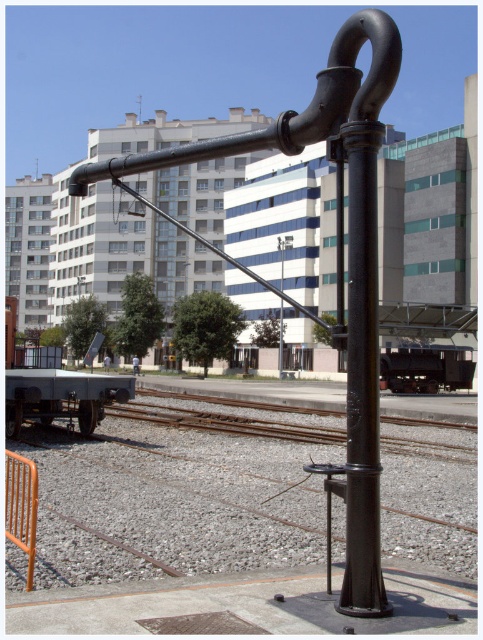
Is black matte pipe at center bigger than orange metallic rail at lower left?

Correct, black matte pipe at center is larger in size than orange metallic rail at lower left.

Does point (228, 150) come in front of point (32, 524)?

Yes.

At what (x,y) coordinates should I click in order to perform the action: click on black matte pipe at center. Please return your answer as a coordinate pair (x, y). This screenshot has height=640, width=483. Looking at the image, I should click on (289, 109).

Is orange metallic rail at lower left below black metal lamp post at center?

Yes, orange metallic rail at lower left is below black metal lamp post at center.

Does orange metallic rail at lower left appear on the left side of black metal lamp post at center?

Indeed, orange metallic rail at lower left is positioned on the left side of black metal lamp post at center.

Image resolution: width=483 pixels, height=640 pixels. What do you see at coordinates (20, 506) in the screenshot?
I see `orange metallic rail at lower left` at bounding box center [20, 506].

The width and height of the screenshot is (483, 640). I want to click on orange metallic rail at lower left, so click(x=20, y=506).

Which is above, black matte pipe at center or black metal lamp post at center?

Positioned higher is black matte pipe at center.

Is black matte pipe at center below black metal lamp post at center?

No, black matte pipe at center is not below black metal lamp post at center.

Locate an element on the screen. The width and height of the screenshot is (483, 640). black matte pipe at center is located at coordinates (289, 109).